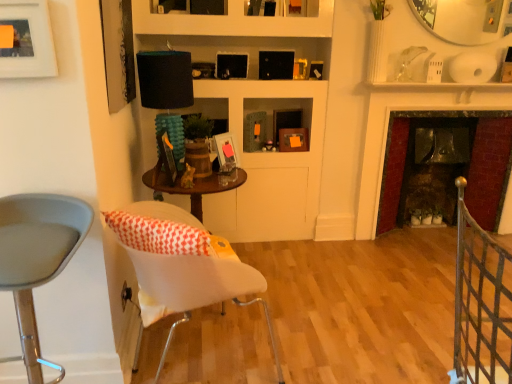
Question: Considering the relative sizes of matte black picture frame at upper center, the fifth picture frame in the front-to-back sequence, and matte wooden picture frame at center, the 4th picture frame viewed from the left, in the image provided, is matte black picture frame at upper center, the fifth picture frame in the front-to-back sequence, bigger than matte wooden picture frame at center, the 4th picture frame viewed from the left,?

Choices:
 (A) yes
 (B) no

Answer: (B)

Question: From the image's perspective, would you say matte black picture frame at upper center, which ranks as the first picture frame in right-to-left order, is positioned over matte wooden picture frame at center, which is the fourth picture frame in front-to-back order?

Choices:
 (A) no
 (B) yes

Answer: (B)

Question: From the image's perspective, does matte black picture frame at upper center, which ranks as the first picture frame in right-to-left order, appear lower than matte wooden picture frame at center, which is the fourth picture frame in front-to-back order?

Choices:
 (A) no
 (B) yes

Answer: (A)

Question: Is matte wooden picture frame at center, arranged as the 2th picture frame when viewed from the right, located within matte black picture frame at upper center, marked as the 5th picture frame in a left-to-right arrangement?

Choices:
 (A) no
 (B) yes

Answer: (A)

Question: From a real-world perspective, is matte black picture frame at upper center, the fifth picture frame in the front-to-back sequence, positioned over matte wooden picture frame at center, the 4th picture frame viewed from the left, based on gravity?

Choices:
 (A) yes
 (B) no

Answer: (B)

Question: Is matte black picture frame at upper center, the first picture frame viewed from the back, inside the boundaries of woodenmaterial/texturebookshelf at upper center, or outside?

Choices:
 (A) outside
 (B) inside

Answer: (B)

Question: Is matte black picture frame at upper center, which ranks as the first picture frame in right-to-left order, in front of or behind woodenmaterial/texturebookshelf at upper center in the image?

Choices:
 (A) front
 (B) behind

Answer: (B)

Question: Based on their sizes in the image, would you say matte black picture frame at upper center, which ranks as the first picture frame in right-to-left order, is bigger or smaller than woodenmaterial/texturebookshelf at upper center?

Choices:
 (A) big
 (B) small

Answer: (B)

Question: Is point (284, 147) positioned closer to the camera than point (249, 41)?

Choices:
 (A) farther
 (B) closer

Answer: (A)

Question: From a real-world perspective, is white plastic chair at center, the first chair from the right, positioned above or below dark red brick fireplace at right?

Choices:
 (A) above
 (B) below

Answer: (B)

Question: From the image's perspective, is white plastic chair at center, marked as the second chair in a left-to-right arrangement, positioned above or below dark red brick fireplace at right?

Choices:
 (A) above
 (B) below

Answer: (B)

Question: Considering the positions of white plastic chair at center, marked as the second chair in a left-to-right arrangement, and dark red brick fireplace at right in the image, is white plastic chair at center, marked as the second chair in a left-to-right arrangement, taller or shorter than dark red brick fireplace at right?

Choices:
 (A) short
 (B) tall

Answer: (A)

Question: Is white plastic chair at center, the first chair from the right, wider or thinner than dark red brick fireplace at right?

Choices:
 (A) thin
 (B) wide

Answer: (B)

Question: Is black metal gate at lower right wider or thinner than matte wooden picture frame at center, positioned as the second picture frame in back-to-front order?

Choices:
 (A) thin
 (B) wide

Answer: (B)

Question: Considering the positions of black metal gate at lower right and matte wooden picture frame at center, which is the fourth picture frame in front-to-back order, in the image, is black metal gate at lower right taller or shorter than matte wooden picture frame at center, which is the fourth picture frame in front-to-back order,?

Choices:
 (A) tall
 (B) short

Answer: (A)